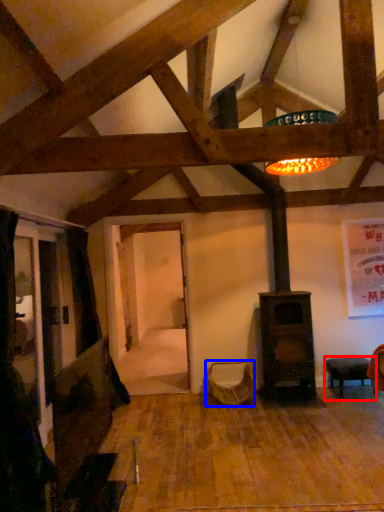
Question: Which of the following is the farthest to the observer, furniture (highlighted by a red box) or swivel chair (highlighted by a blue box)?

Choices:
 (A) furniture
 (B) swivel chair

Answer: (B)